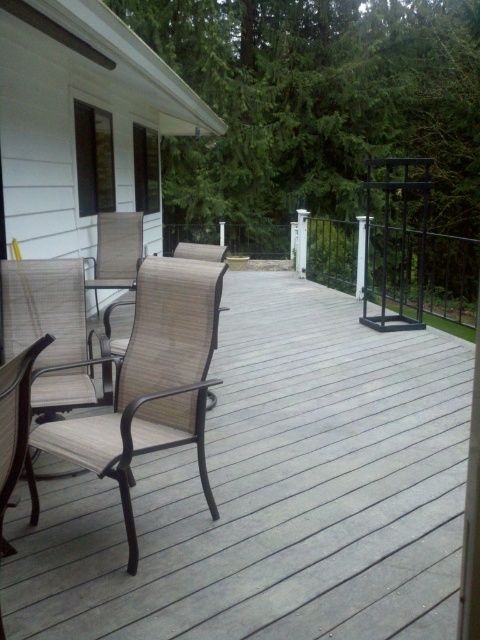
Question: Which of these objects is positioned farthest from the beige fabric chair at center?

Choices:
 (A) brown woven chairs at center
 (B) sanded wood chair at left
 (C) sandy beige woven chair at center

Answer: (C)

Question: Which of these objects is positioned closest to the sandy beige woven chair at center?

Choices:
 (A) brown woven chairs at center
 (B) beige fabric chair at center

Answer: (A)

Question: Does brown woven chairs at center have a lesser width compared to sandy beige woven chair at center?

Choices:
 (A) yes
 (B) no

Answer: (B)

Question: Is brown woven chairs at center in front of beige fabric chair at center?

Choices:
 (A) yes
 (B) no

Answer: (B)

Question: Is brown woven chairs at center below sandy beige woven chair at center?

Choices:
 (A) yes
 (B) no

Answer: (A)

Question: Estimate the real-world distances between objects in this image. Which object is farther from the beige fabric chair at center?

Choices:
 (A) brown woven chairs at center
 (B) sanded wood chair at left
 (C) sandy beige woven chair at center

Answer: (C)